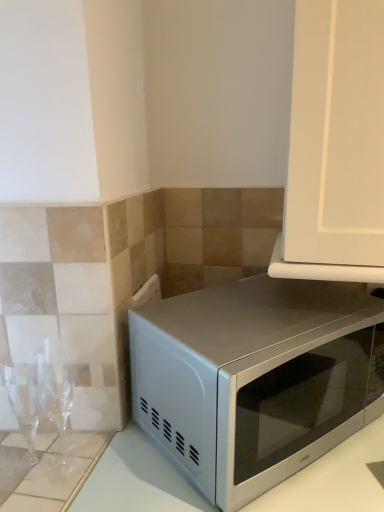
This screenshot has height=512, width=384. What are the coordinates of `free space above satin silver microwave at lower right (from a real-world perspective)` in the screenshot? It's located at (279, 322).